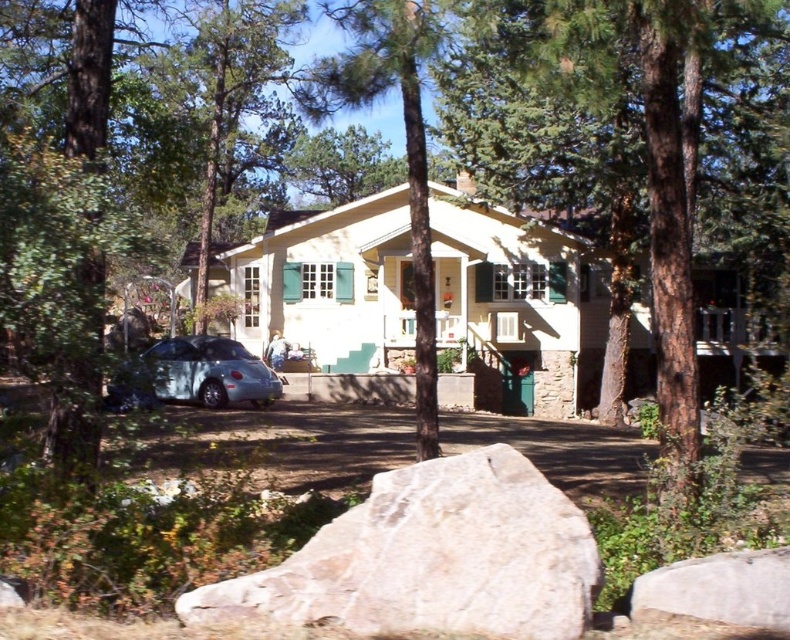
You are a delivery person trying to park your truck, which is 18 feet long, in the driveway between the green textured tree at center and the gray rough rock at lower right. Can your truck fit there?

The distance between the green textured tree at center and the gray rough rock at lower right is 20.05 feet. Since your truck is 18 feet long, it can fit in the driveway between them as there is enough space.

You are a delivery person approaching the house and need to place a heavy package on the ground. The package is too big to carry while navigating around the driveway. You see the white rough rock at lower center and the gray asphalt driveway at center. Which surface should you choose to place the package so it stays stable and doesn

The white rough rock at lower center is in front of the gray asphalt driveway at center. Since the rock is positioned in front, it is closer to your current position as you approach the house. Placing the package on the white rough rock at lower center ensures stability because rocks typically provide a firm, non slippery surface compared to asphalt which might be smoother and less stable for heavy items.